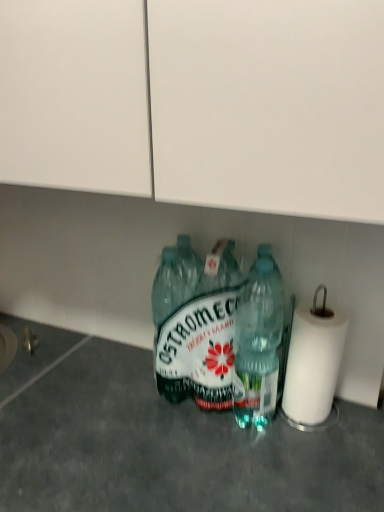
This screenshot has width=384, height=512. I want to click on vacant point to the right of translucent plastic bottle at center, acting as the 2th bottle starting from the left, so click(x=346, y=439).